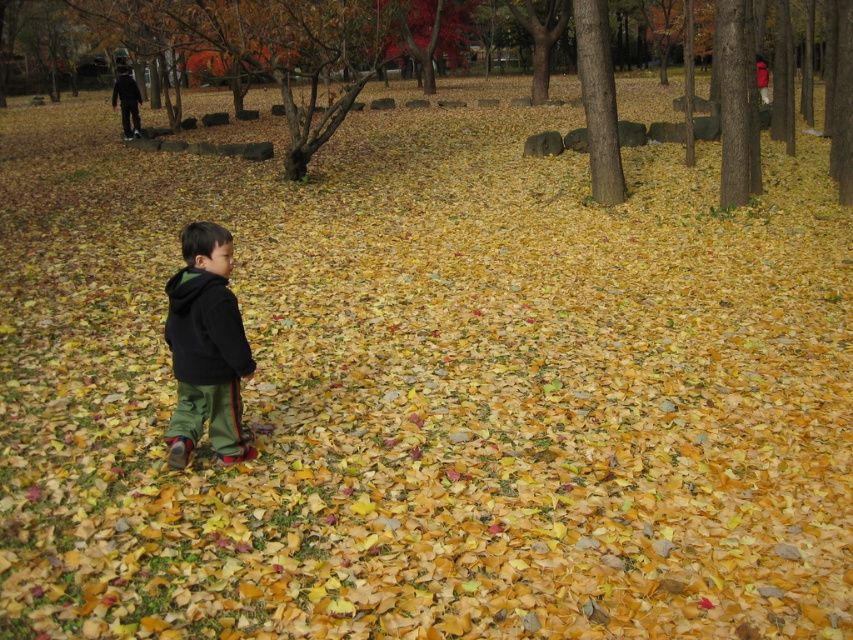
Question: Does brown bark tree at center appear under brown rough bark tree at center?

Choices:
 (A) yes
 (B) no

Answer: (B)

Question: Estimate the real-world distances between objects in this image. Which object is closer to the black fleece jacket at center?

Choices:
 (A) brown rough bark tree at center
 (B) brown bark tree at center

Answer: (A)

Question: Observing the image, what is the correct spatial positioning of brown bark tree at center in reference to black fleece jacket at center?

Choices:
 (A) above
 (B) below

Answer: (A)

Question: Which object is positioned closest to the black fleece jacket at center?

Choices:
 (A) brown bark tree at center
 (B) brown rough bark tree at center

Answer: (B)

Question: Based on their relative distances, which object is nearer to the brown bark tree at center?

Choices:
 (A) brown rough bark tree at center
 (B) black fleece jacket at center

Answer: (A)

Question: Observing the image, what is the correct spatial positioning of brown bark tree at center in reference to brown rough bark tree at center?

Choices:
 (A) below
 (B) above

Answer: (B)